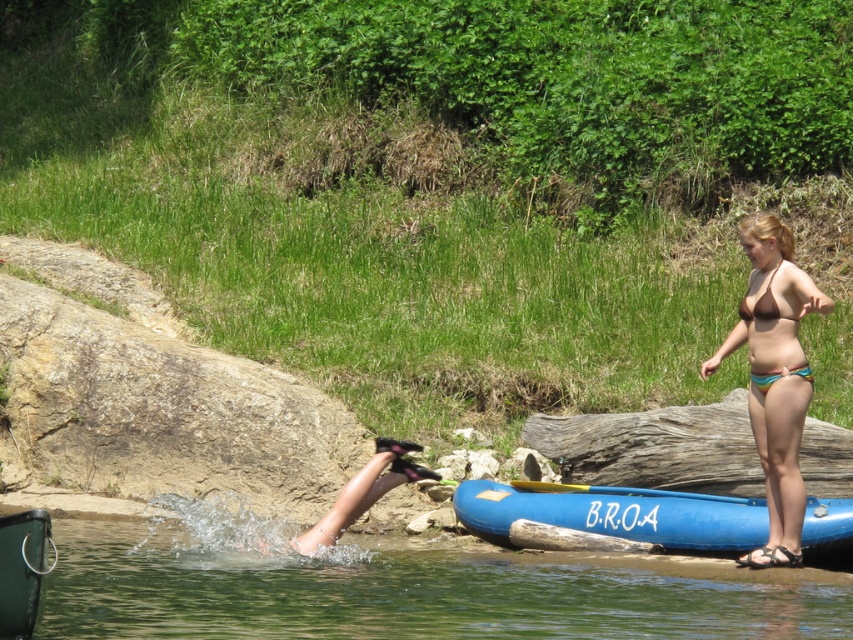
Who is taller, gray rough log at center or brown bikini at right?

gray rough log at center is taller.

Is point (546, 426) in front of point (770, 224)?

No.

Is point (643, 413) more distant than point (769, 456)?

Yes.

The image size is (853, 640). Find the location of `gray rough log at center`. gray rough log at center is located at coordinates (656, 448).

Is the position of clear water at lower left more distant than that of yellow wood paddle at lower center?

No, it is not.

Between point (79, 580) and point (596, 484), which one is positioned behind?

The point (596, 484) is behind.

Find the location of a particular element. The image size is (853, 640). clear water at lower left is located at coordinates (396, 592).

Does gray rough log at center appear on the right side of blue rubber canoe at lower right?

Indeed, gray rough log at center is positioned on the right side of blue rubber canoe at lower right.

Does gray rough log at center appear on the left side of blue rubber canoe at lower right?

No, gray rough log at center is not to the left of blue rubber canoe at lower right.

Who is more distant from viewer, (554, 449) or (715, 502)?

The point (554, 449) is more distant.

At what (x,y) coordinates should I click in order to perform the action: click on gray rough log at center. Please return your answer as a coordinate pair (x, y). Looking at the image, I should click on (656, 448).